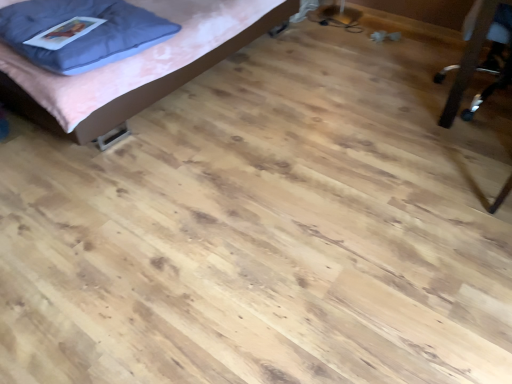
Question: Should I look upward or downward to see matte pink bed at upper left?

Choices:
 (A) down
 (B) up

Answer: (B)

Question: From the image's perspective, is matte pink bed at upper left over metallic silver chair at right?

Choices:
 (A) yes
 (B) no

Answer: (A)

Question: Are matte pink bed at upper left and metallic silver chair at right located far from each other?

Choices:
 (A) no
 (B) yes

Answer: (B)

Question: Is matte pink bed at upper left outside of metallic silver chair at right?

Choices:
 (A) yes
 (B) no

Answer: (A)

Question: Considering the relative sizes of matte pink bed at upper left and metallic silver chair at right in the image provided, is matte pink bed at upper left thinner than metallic silver chair at right?

Choices:
 (A) no
 (B) yes

Answer: (A)

Question: From a real-world perspective, is matte pink bed at upper left on top of metallic silver chair at right?

Choices:
 (A) no
 (B) yes

Answer: (B)

Question: Does matte pink bed at upper left have a lesser height compared to metallic silver chair at right?

Choices:
 (A) no
 (B) yes

Answer: (A)

Question: Considering the relative positions of blue fabric pillow at upper left and metallic silver chair at right in the image provided, is blue fabric pillow at upper left behind metallic silver chair at right?

Choices:
 (A) no
 (B) yes

Answer: (B)

Question: Considering the relative sizes of blue fabric pillow at upper left and metallic silver chair at right in the image provided, is blue fabric pillow at upper left wider than metallic silver chair at right?

Choices:
 (A) yes
 (B) no

Answer: (B)

Question: Can you confirm if blue fabric pillow at upper left is smaller than metallic silver chair at right?

Choices:
 (A) no
 (B) yes

Answer: (B)

Question: Is blue fabric pillow at upper left to the left of metallic silver chair at right from the viewer's perspective?

Choices:
 (A) yes
 (B) no

Answer: (A)

Question: Can you confirm if blue fabric pillow at upper left is taller than metallic silver chair at right?

Choices:
 (A) yes
 (B) no

Answer: (B)

Question: Is blue fabric pillow at upper left positioned before metallic silver chair at right?

Choices:
 (A) no
 (B) yes

Answer: (A)

Question: Considering the relative positions of metallic silver chair at right and blue fabric pillow at upper left in the image provided, is metallic silver chair at right to the left of blue fabric pillow at upper left from the viewer's perspective?

Choices:
 (A) no
 (B) yes

Answer: (A)